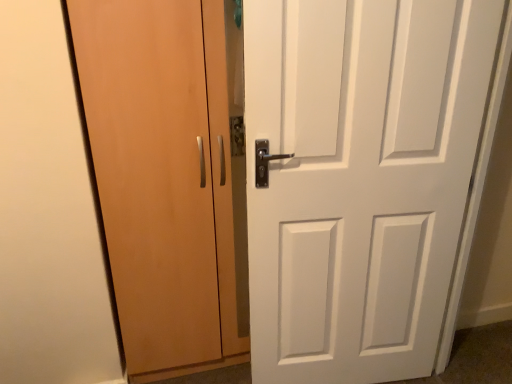
Question: Can you confirm if white matte door at center, the 2th door when ordered from left to right, is smaller than matte wood cabinet at left, marked as the 2th door in a right-to-left arrangement?

Choices:
 (A) yes
 (B) no

Answer: (A)

Question: Considering the relative sizes of white matte door at center, which is counted as the first door, starting from the right, and matte wood cabinet at left, marked as the 1th door in a left-to-right arrangement, in the image provided, is white matte door at center, which is counted as the first door, starting from the right, wider than matte wood cabinet at left, marked as the 1th door in a left-to-right arrangement,?

Choices:
 (A) yes
 (B) no

Answer: (B)

Question: Does white matte door at center, the 2th door when ordered from left to right, lie behind matte wood cabinet at left, marked as the 1th door in a left-to-right arrangement?

Choices:
 (A) no
 (B) yes

Answer: (A)

Question: Is matte wood cabinet at left, marked as the 2th door in a right-to-left arrangement, a part of white matte door at center, the 2th door when ordered from left to right?

Choices:
 (A) yes
 (B) no

Answer: (B)

Question: Is white matte door at center, the 2th door when ordered from left to right, positioned beyond the bounds of matte wood cabinet at left, marked as the 2th door in a right-to-left arrangement?

Choices:
 (A) no
 (B) yes

Answer: (B)

Question: Is white matte door at center, the 2th door when ordered from left to right, positioned far away from matte wood cabinet at left, marked as the 1th door in a left-to-right arrangement?

Choices:
 (A) no
 (B) yes

Answer: (A)

Question: From the image's perspective, is matte wood cabinet at left, marked as the 1th door in a left-to-right arrangement, located above white matte door at center, which is counted as the first door, starting from the right?

Choices:
 (A) yes
 (B) no

Answer: (A)

Question: Does matte wood cabinet at left, marked as the 1th door in a left-to-right arrangement, have a larger size compared to white matte door at center, which is counted as the first door, starting from the right?

Choices:
 (A) no
 (B) yes

Answer: (B)

Question: Can you confirm if matte wood cabinet at left, marked as the 2th door in a right-to-left arrangement, is positioned to the left of white matte door at center, the 2th door when ordered from left to right?

Choices:
 (A) no
 (B) yes

Answer: (B)

Question: Considering the relative sizes of matte wood cabinet at left, marked as the 1th door in a left-to-right arrangement, and white matte door at center, the 2th door when ordered from left to right, in the image provided, is matte wood cabinet at left, marked as the 1th door in a left-to-right arrangement, taller than white matte door at center, the 2th door when ordered from left to right,?

Choices:
 (A) yes
 (B) no

Answer: (A)

Question: Could you tell me if matte wood cabinet at left, marked as the 2th door in a right-to-left arrangement, is turned towards white matte door at center, the 2th door when ordered from left to right?

Choices:
 (A) no
 (B) yes

Answer: (A)

Question: Is white matte door at center, which is counted as the first door, starting from the right, surrounded by matte wood cabinet at left, marked as the 1th door in a left-to-right arrangement?

Choices:
 (A) yes
 (B) no

Answer: (B)

Question: Looking at their shapes, would you say matte wood cabinet at left, marked as the 1th door in a left-to-right arrangement, is wider or thinner than white matte door at center, the 2th door when ordered from left to right?

Choices:
 (A) thin
 (B) wide

Answer: (B)